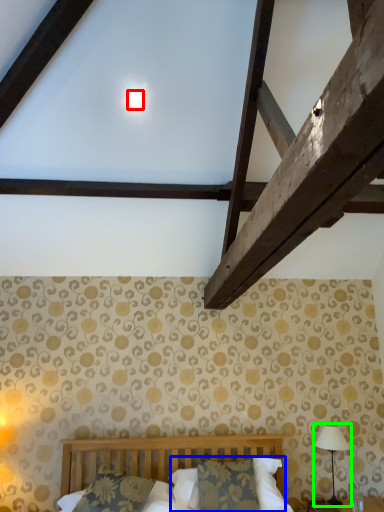
Question: Which is farther away from moonlight (highlighted by a red box)? pillow (highlighted by a blue box) or table lamp (highlighted by a green box)?

Choices:
 (A) pillow
 (B) table lamp

Answer: (B)